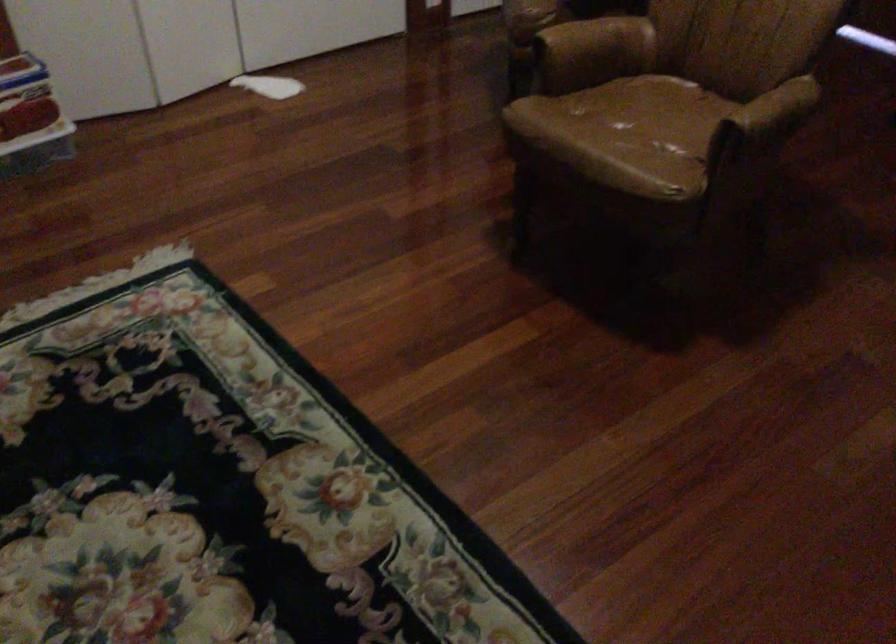
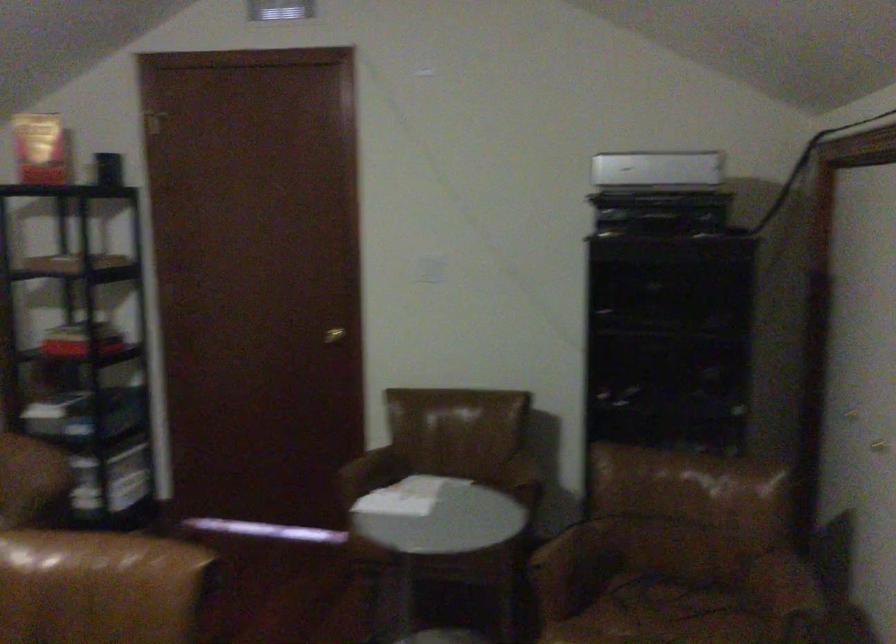
The images are taken continuously from a first-person perspective. In which direction is your viewpoint rotating?

The camera's rotation is toward right-up.